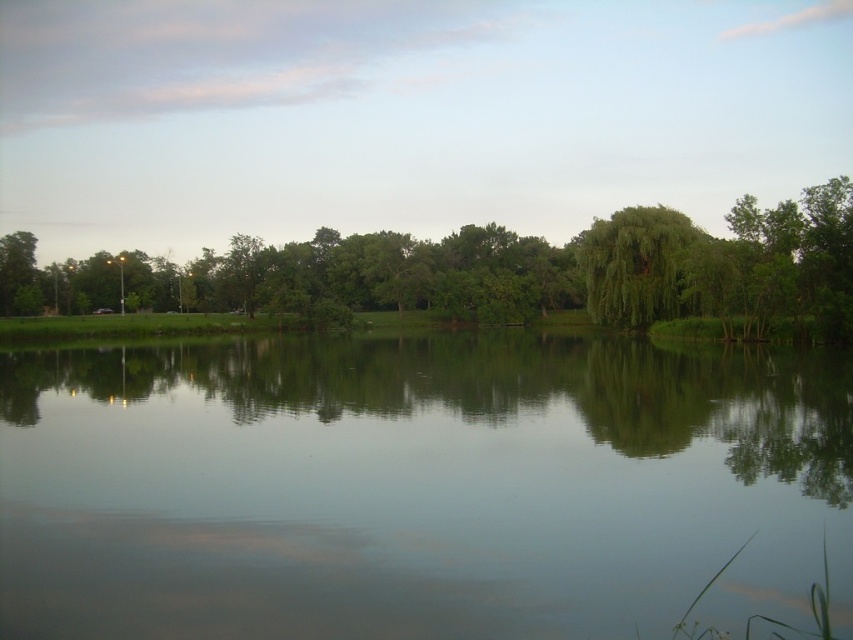
Who is more distant from viewer, (422, 262) or (606, 259)?

The point (422, 262) is more distant.

Between green leafy tree at center and green leafy tree at upper right, which one is positioned lower?

green leafy tree at center is below.

Does point (616, 225) come closer to viewer compared to point (648, 243)?

No, it is behind (648, 243).

This screenshot has height=640, width=853. In order to click on green leafy tree at center in this screenshot , I will do `click(495, 273)`.

Which is in front, point (590, 372) or point (143, 280)?

Positioned in front is point (590, 372).

Which of these two, transparent water at center or green leafy tree at center, stands taller?

green leafy tree at center

Where is `transparent water at center`? This screenshot has height=640, width=853. transparent water at center is located at coordinates (416, 486).

Can you confirm if transparent water at center is smaller than green leafy tree at upper right?

Correct, transparent water at center occupies less space than green leafy tree at upper right.

The image size is (853, 640). Describe the element at coordinates (416, 486) in the screenshot. I see `transparent water at center` at that location.

Locate an element on the screen. Image resolution: width=853 pixels, height=640 pixels. transparent water at center is located at coordinates (416, 486).